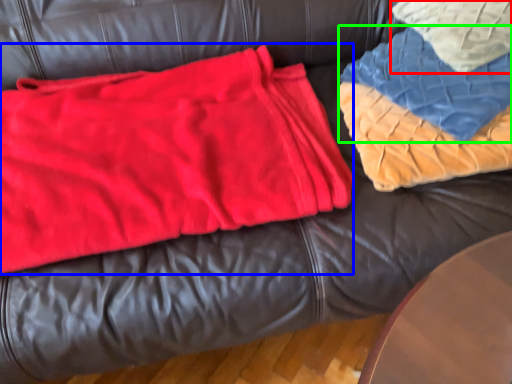
Question: Which is farther away from throw pillow (highlighted by a red box)? bean bag chair (highlighted by a blue box) or blanket (highlighted by a green box)?

Choices:
 (A) bean bag chair
 (B) blanket

Answer: (A)